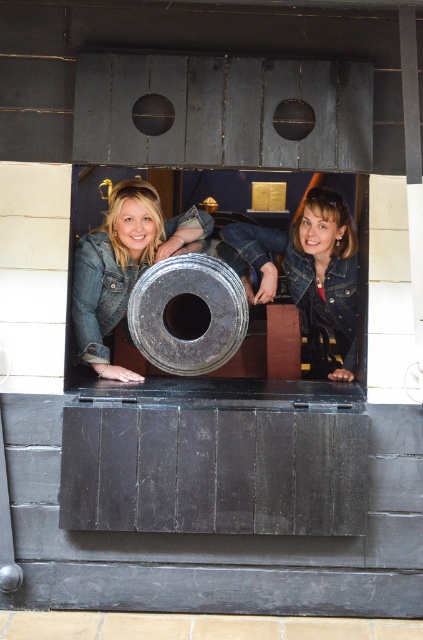
In the scene shown: You are standing in front of the cannon and see two points marked on the cannon. The first point is at coordinates point (315, 241) and the second is at point (90, 248). Which point is closer to you?

Point (315, 241) is further to the viewer than point (90, 248). Therefore, the second point at point (90, 248) is closer to you.

Based on the photo, you are standing in front of the cannon and see the denim jacket at center and the brushed metal denim jacket at lower center. Which one is positioned more to the right side?

→ The denim jacket at center is positioned more to the right side than the brushed metal denim jacket at lower center.

You are a photographer trying to capture both the denim jacket at center and the brushed metal denim jacket at lower center in a single shot. Which jacket should you focus on first to ensure both are in focus?

You should focus on the denim jacket at center first since it is closer to the viewer than the brushed metal denim jacket at lower center, ensuring both will be in focus when focusing on the closer object.